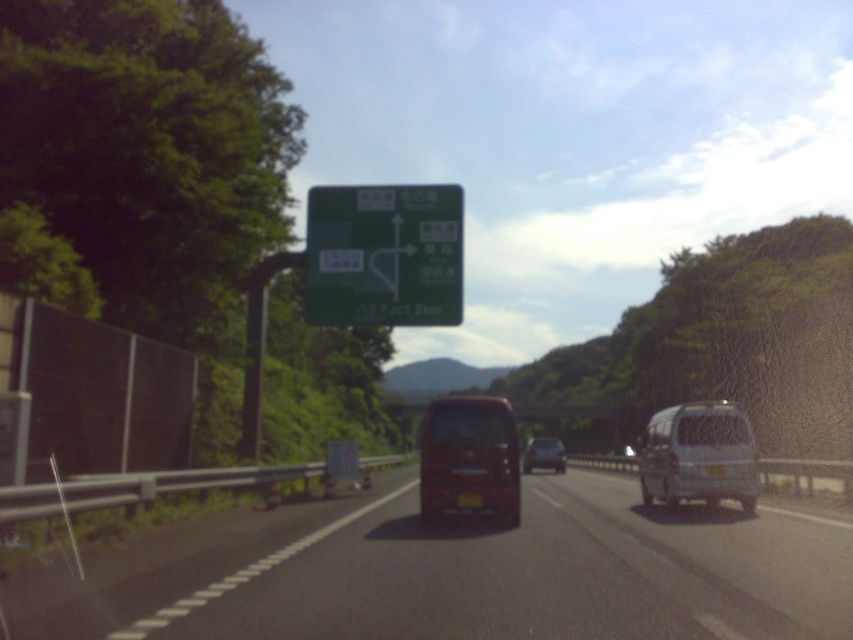
The height and width of the screenshot is (640, 853). Find the location of `green matte sign at center`. green matte sign at center is located at coordinates (384, 256).

Between green matte sign at center and silver metallic van at right, which one appears on the right side from the viewer's perspective?

silver metallic van at right

Does point (462, 218) come in front of point (695, 429)?

No, it is not.

At what (x,y) coordinates should I click in order to perform the action: click on green matte sign at center. Please return your answer as a coordinate pair (x, y). The image size is (853, 640). Looking at the image, I should click on (384, 256).

Which is above, metallic red bus at center or white plastic license plate at center?

white plastic license plate at center is higher up.

Is point (469, 397) positioned in front of point (711, 467)?

Yes, it is.

Where is `metallic red bus at center`? metallic red bus at center is located at coordinates (469, 456).

Is matte black van at center shorter than white plastic license plate at center?

No, matte black van at center is not shorter than white plastic license plate at center.

The image size is (853, 640). In order to click on matte black van at center in this screenshot , I will do `click(543, 454)`.

The height and width of the screenshot is (640, 853). What are the coordinates of `matte black van at center` in the screenshot? It's located at (543, 454).